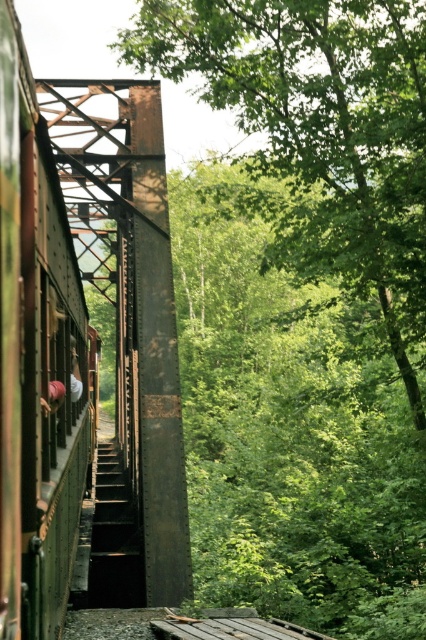
Is point (77, 262) farther from viewer compared to point (92, 604)?

Yes.

Is point (135, 353) farther from camera compared to point (117, 474)?

No, it is not.

Find the location of a particular element. This screenshot has width=426, height=640. rusty metal train bridge at center is located at coordinates (129, 326).

Is point (94, 157) behind point (31, 576)?

Yes, point (94, 157) is behind point (31, 576).

Which of these two, rusty metal train bridge at center or green matte train at left, stands taller?

Standing taller between the two is rusty metal train bridge at center.

Is point (135, 419) closer to viewer compared to point (23, 320)?

No, it is not.

Identify the location of rusty metal train bridge at center. click(129, 326).

Does green leafy tree at center have a larger size compared to rusty metal stairs at center?

Indeed, green leafy tree at center has a larger size compared to rusty metal stairs at center.

Which is in front, point (325, 45) or point (114, 484)?

Positioned in front is point (325, 45).

Is point (235, 83) farther from viewer compared to point (109, 580)?

That is True.

Find the location of `green leafy tree at center`. green leafy tree at center is located at coordinates (319, 134).